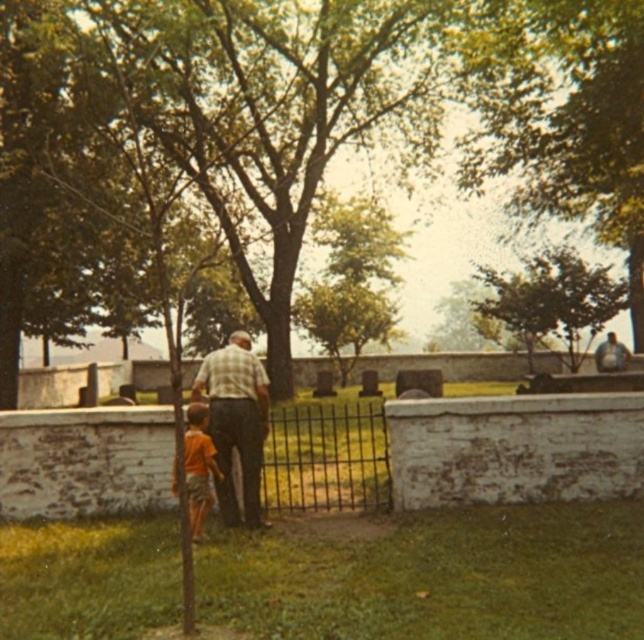
Question: Is black wrought iron gate at center bigger than plaid fabric at center?

Choices:
 (A) no
 (B) yes

Answer: (B)

Question: Can you confirm if black wrought iron gate at center is bigger than orange cotton shirt at lower left?

Choices:
 (A) no
 (B) yes

Answer: (B)

Question: Which point is farther from the camera taking this photo?

Choices:
 (A) (200, 477)
 (B) (238, 420)

Answer: (B)

Question: Does plaid fabric at center come in front of matte gray shirt at upper right?

Choices:
 (A) yes
 (B) no

Answer: (A)

Question: Estimate the real-world distances between objects in this image. Which object is closer to the matte gray shirt at upper right?

Choices:
 (A) orange cotton shirt at lower left
 (B) plaid fabric at center
 (C) black wrought iron gate at center

Answer: (C)

Question: Estimate the real-world distances between objects in this image. Which object is farther from the black wrought iron gate at center?

Choices:
 (A) matte gray shirt at upper right
 (B) plaid fabric at center
 (C) orange cotton shirt at lower left

Answer: (A)